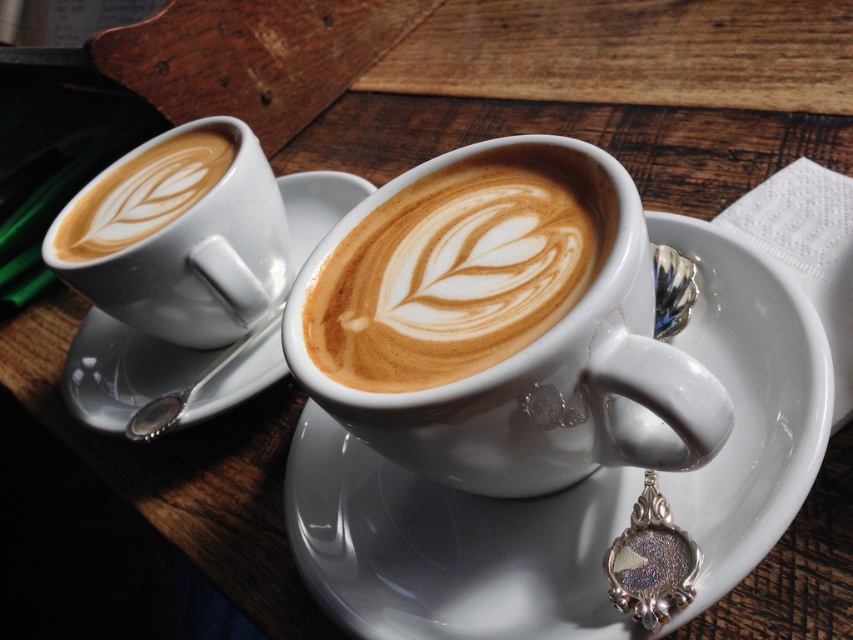
You are a barista arranging items on a table. You need to place a new coffee cup at point (448, 547). Is there space available at that point?

There is a white glossy saucer at center located at point (448, 547), so placing a new coffee cup there would not be possible due to the existing saucer occupying that space.

You are a barista trying to clean the white glossy saucer at center and the latte art at upper left. Which object should you clean first if you want to start with the one closer to you?

The white glossy saucer at center is closer to the viewer than the latte art at upper left, so you should clean the white glossy saucer at center first.

You are a barista arranging items on a table. You need to place a decorative silver spoon on the white glossy saucer at center without covering the latte art at upper left. Can you do this?

The white glossy saucer at center is located below the latte art at upper left, so placing the spoon on the saucer will not cover the latte art at upper left since they are in different vertical positions.